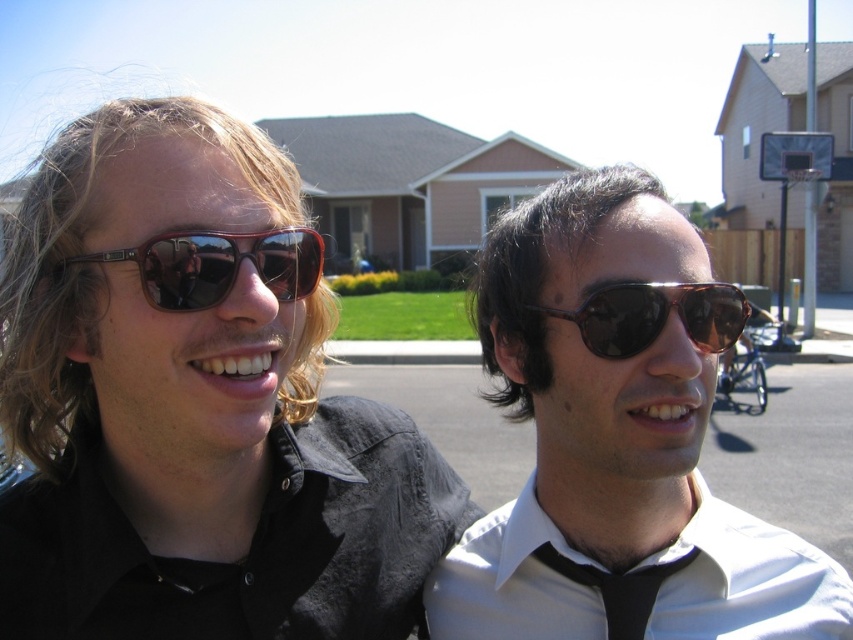
You are a delivery person who needs to place a package between the matte brown sunglasses at left and the shiny brown sunglasses at center. The package requires 15 inches of space to fit. Can you fit the package between them?

The distance between the matte brown sunglasses at left and the shiny brown sunglasses at center is 14.90 inches. Since the package requires 15 inches of space, it cannot fit between them.

You are standing at the point with coordinates point (99,257) and want to walk towards the house with the gray roof. There is an obstacle at point (730,330). Will you pass in front of or behind the obstacle?

Since point (99,257) is in front of point (730,330), you will pass in front of the obstacle at point (730,330) when walking towards the house with the gray roof.